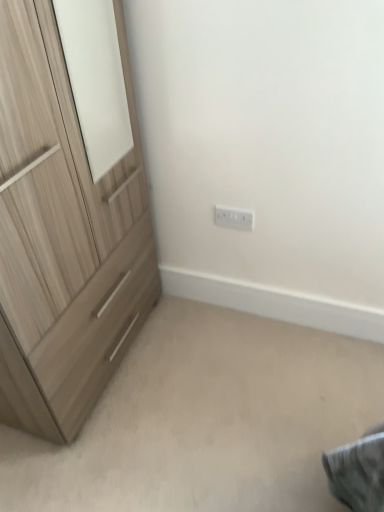
Describe the element at coordinates (234, 218) in the screenshot. I see `white plastic electric outlet at center` at that location.

The width and height of the screenshot is (384, 512). I want to click on white plastic electric outlet at center, so click(234, 218).

Describe the element at coordinates (63, 237) in the screenshot. The height and width of the screenshot is (512, 384). I see `light wood/texture chest of drawers at left` at that location.

Where is `light wood/texture chest of drawers at left`? The height and width of the screenshot is (512, 384). light wood/texture chest of drawers at left is located at coordinates (63, 237).

Image resolution: width=384 pixels, height=512 pixels. Find the location of `white plastic electric outlet at center`. white plastic electric outlet at center is located at coordinates (234, 218).

From the picture: Which object is positioned more to the left, white plastic electric outlet at center or light wood/texture chest of drawers at left?

light wood/texture chest of drawers at left is more to the left.

Which object is more forward, white plastic electric outlet at center or light wood/texture chest of drawers at left?

light wood/texture chest of drawers at left is in front.

Which is less distant, (234, 226) or (157, 265)?

Point (234, 226) is closer to the camera than point (157, 265).

From the image's perspective, is white plastic electric outlet at center positioned above or below light wood/texture chest of drawers at left?

white plastic electric outlet at center is situated higher than light wood/texture chest of drawers at left in the image.

From a real-world perspective, is white plastic electric outlet at center located higher than light wood/texture chest of drawers at left?

No.

Considering the sizes of objects white plastic electric outlet at center and light wood/texture chest of drawers at left in the image provided, who is wider, white plastic electric outlet at center or light wood/texture chest of drawers at left?

light wood/texture chest of drawers at left is wider.

Is white plastic electric outlet at center shorter than light wood/texture chest of drawers at left?

Yes, white plastic electric outlet at center is shorter than light wood/texture chest of drawers at left.

Looking at the image, does white plastic electric outlet at center seem bigger or smaller compared to light wood/texture chest of drawers at left?

In the image, white plastic electric outlet at center appears to be smaller than light wood/texture chest of drawers at left.

Is white plastic electric outlet at center situated inside light wood/texture chest of drawers at left or outside?

white plastic electric outlet at center lies outside light wood/texture chest of drawers at left.

Based on the photo, can you see white plastic electric outlet at center touching light wood/texture chest of drawers at left?

No, white plastic electric outlet at center is not touching light wood/texture chest of drawers at left.

Is white plastic electric outlet at center positioned with its back to light wood/texture chest of drawers at left?

white plastic electric outlet at center does not have its back to light wood/texture chest of drawers at left.

At what (x,y) coordinates should I click in order to perform the action: click on the chest of drawers that appears below the white plastic electric outlet at center (from the image's perspective). Please return your answer as a coordinate pair (x, y). The image size is (384, 512). Looking at the image, I should click on (63, 237).

In the image, is light wood/texture chest of drawers at left on the left side or the right side of white plastic electric outlet at center?

Based on their positions, light wood/texture chest of drawers at left is located to the left of white plastic electric outlet at center.

Considering the relative positions of light wood/texture chest of drawers at left and white plastic electric outlet at center in the image provided, is light wood/texture chest of drawers at left behind white plastic electric outlet at center?

No, light wood/texture chest of drawers at left is closer to the camera.

Does point (124, 196) lie behind point (243, 226)?

That is False.

From the picture: From the image's perspective, is light wood/texture chest of drawers at left located above or below white plastic electric outlet at center?

Based on their image positions, light wood/texture chest of drawers at left is located beneath white plastic electric outlet at center.

From a real-world perspective, is light wood/texture chest of drawers at left beneath white plastic electric outlet at center?

No.

Does light wood/texture chest of drawers at left have a lesser width compared to white plastic electric outlet at center?

→ Incorrect, the width of light wood/texture chest of drawers at left is not less than that of white plastic electric outlet at center.

Between light wood/texture chest of drawers at left and white plastic electric outlet at center, which one has less height?

With less height is white plastic electric outlet at center.

Does light wood/texture chest of drawers at left have a larger size compared to white plastic electric outlet at center?

Yes.

Is light wood/texture chest of drawers at left inside or outside of white plastic electric outlet at center?

light wood/texture chest of drawers at left lies outside white plastic electric outlet at center.

Is light wood/texture chest of drawers at left not close to white plastic electric outlet at center?

No, there isn't a large distance between light wood/texture chest of drawers at left and white plastic electric outlet at center.

Is light wood/texture chest of drawers at left oriented towards white plastic electric outlet at center?

Yes.

Can you tell me how much light wood/texture chest of drawers at left and white plastic electric outlet at center differ in facing direction?

The angle between the facing direction of light wood/texture chest of drawers at left and the facing direction of white plastic electric outlet at center is 88.6 degrees.

Measure the distance between light wood/texture chest of drawers at left and white plastic electric outlet at center.

light wood/texture chest of drawers at left is 25.01 inches from white plastic electric outlet at center.

At what (x,y) coordinates should I click in order to perform the action: click on the chest of drawers above the white plastic electric outlet at center (from a real-world perspective). Please return your answer as a coordinate pair (x, y). This screenshot has width=384, height=512. Looking at the image, I should click on 63,237.

Locate an element on the screen. Image resolution: width=384 pixels, height=512 pixels. chest of drawers on the left of white plastic electric outlet at center is located at coordinates point(63,237).

Identify the location of the chest of drawers that appears below the white plastic electric outlet at center (from the image's perspective). The image size is (384, 512). (63, 237).